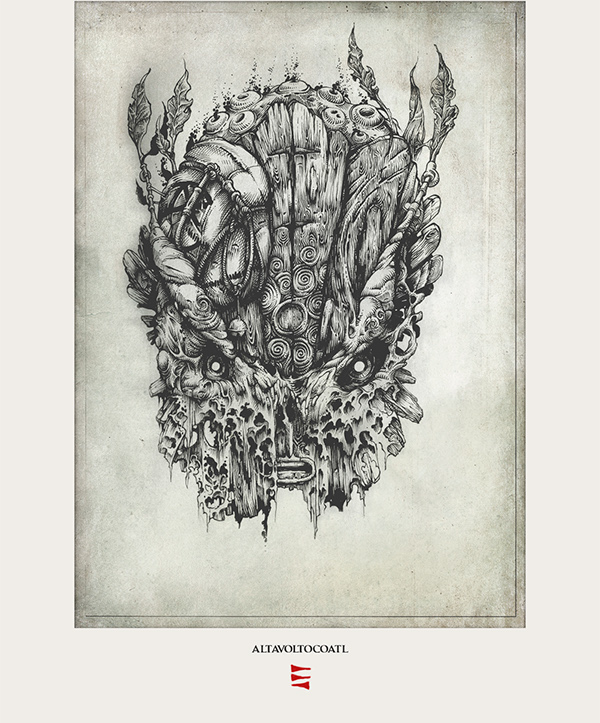
This screenshot has height=723, width=600. Identify the location of the top left corner white photo mat. (3, 1).